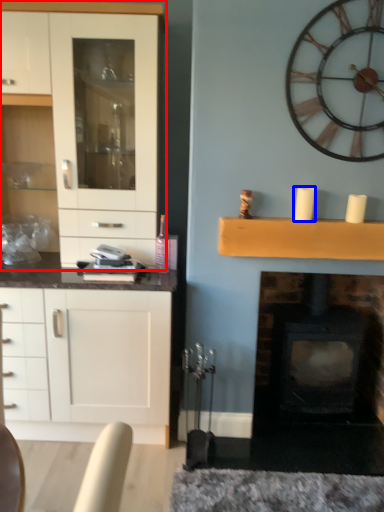
Question: Which object is further to the camera taking this photo, cabinetry (highlighted by a red box) or candle (highlighted by a blue box)?

Choices:
 (A) cabinetry
 (B) candle

Answer: (B)